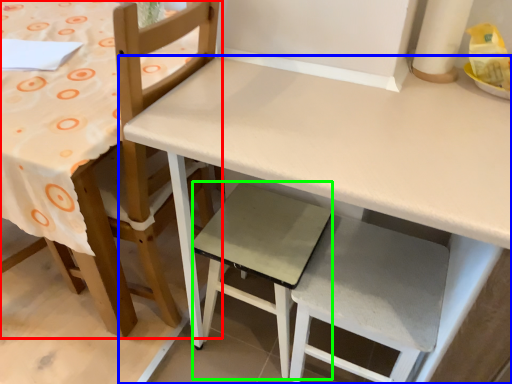
Question: Which object is the closest to the chair (highlighted by a red box)? Choose among these: table (highlighted by a blue box) or step stool (highlighted by a green box).

Choices:
 (A) table
 (B) step stool

Answer: (B)